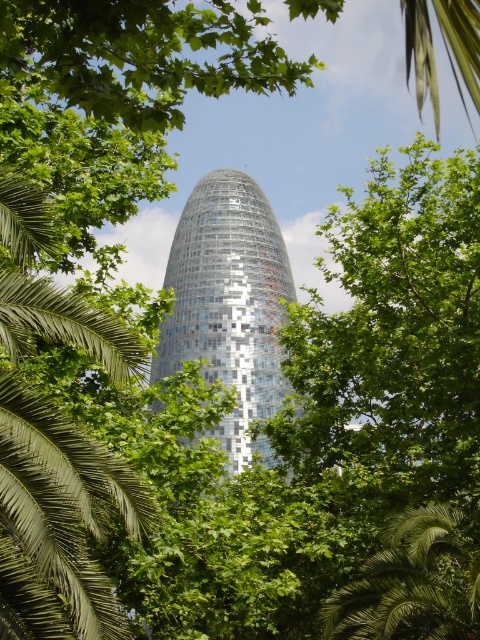
Question: Considering the real-world distances, which object is farthest from the shiny glass tower at center?

Choices:
 (A) green leafy palm tree at lower right
 (B) green leafy palm tree at left

Answer: (B)

Question: Which point is closer to the camera taking this photo?

Choices:
 (A) (2, 616)
 (B) (373, 554)

Answer: (A)

Question: Estimate the real-world distances between objects in this image. Which object is farther from the green leafy palm tree at lower right?

Choices:
 (A) shiny glass tower at center
 (B) green leafy palm tree at left

Answer: (A)

Question: Does green leafy palm tree at left appear under shiny glass tower at center?

Choices:
 (A) yes
 (B) no

Answer: (A)

Question: Can you confirm if shiny glass tower at center is positioned to the right of green leafy palm tree at lower right?

Choices:
 (A) no
 (B) yes

Answer: (A)

Question: Is shiny glass tower at center wider than green leafy palm tree at lower right?

Choices:
 (A) yes
 (B) no

Answer: (A)